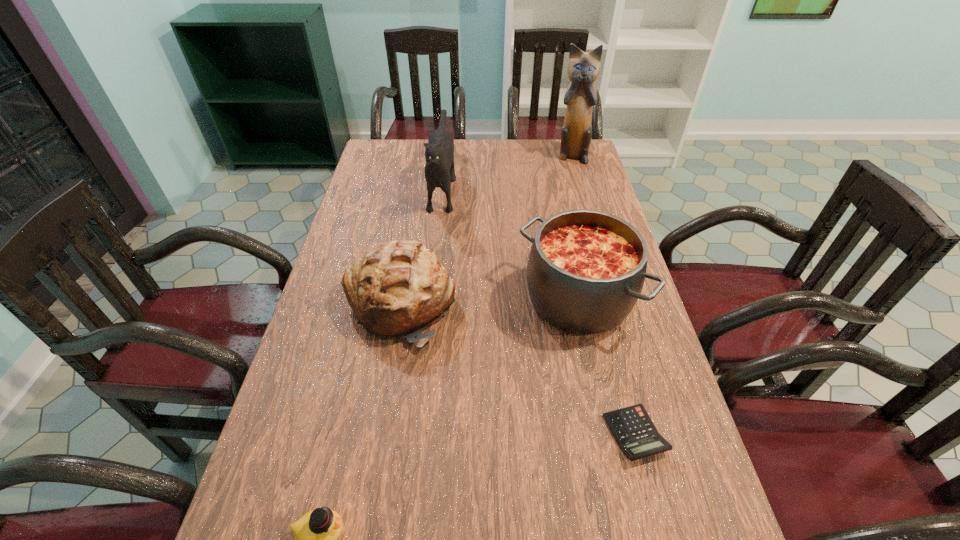
In the image, there is a desktop. Identify the location of vacant space at the right edge. Image resolution: width=960 pixels, height=540 pixels. (644, 499).

At what (x,y) coordinates should I click in order to perform the action: click on free region at the far right corner of the desktop. Please return your answer as a coordinate pair (x, y). Image resolution: width=960 pixels, height=540 pixels. Looking at the image, I should click on 551,163.

Identify the location of vacant area that lies between the calculator and the casserole. (607, 366).

Where is `free point between the shortest object and the third shortest object`? This screenshot has width=960, height=540. free point between the shortest object and the third shortest object is located at coordinates (517, 369).

At what (x,y) coordinates should I click in order to perform the action: click on unoccupied area between the casserole and the shortest object. Please return your answer as a coordinate pair (x, y). This screenshot has width=960, height=540. Looking at the image, I should click on (607, 366).

Locate an element on the screen. The image size is (960, 540). free space between the calculator and the bread is located at coordinates (517, 369).

Locate an element on the screen. This screenshot has width=960, height=540. the third closest object to the casserole is located at coordinates (439, 170).

The height and width of the screenshot is (540, 960). Find the location of `object identified as the closest to the right cat`. object identified as the closest to the right cat is located at coordinates (439, 170).

Where is `blank area in the image that satisfies the following two spatial constraints: 1. on the front side of the fourth shortest object; 2. on the right side of the second nearest object`? This screenshot has width=960, height=540. blank area in the image that satisfies the following two spatial constraints: 1. on the front side of the fourth shortest object; 2. on the right side of the second nearest object is located at coordinates (608, 434).